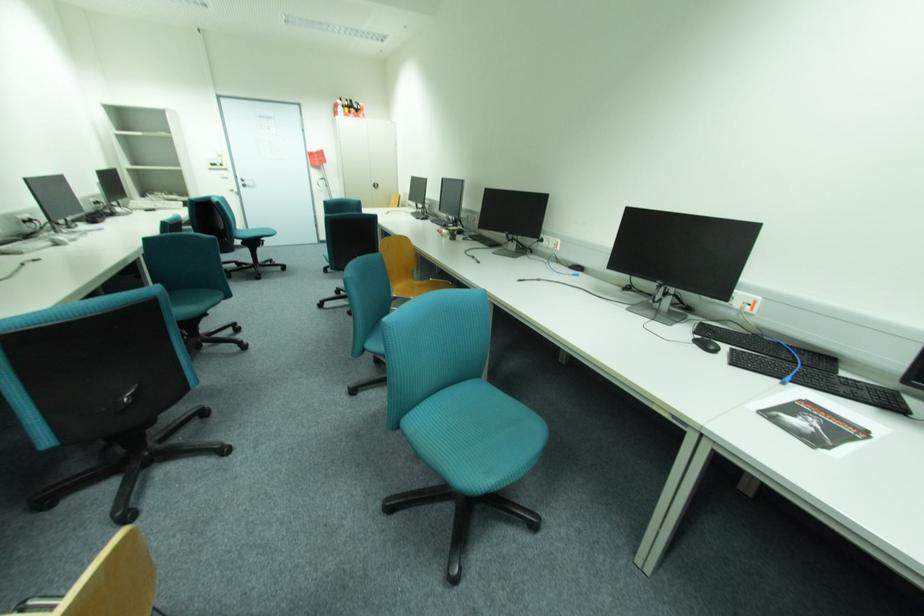
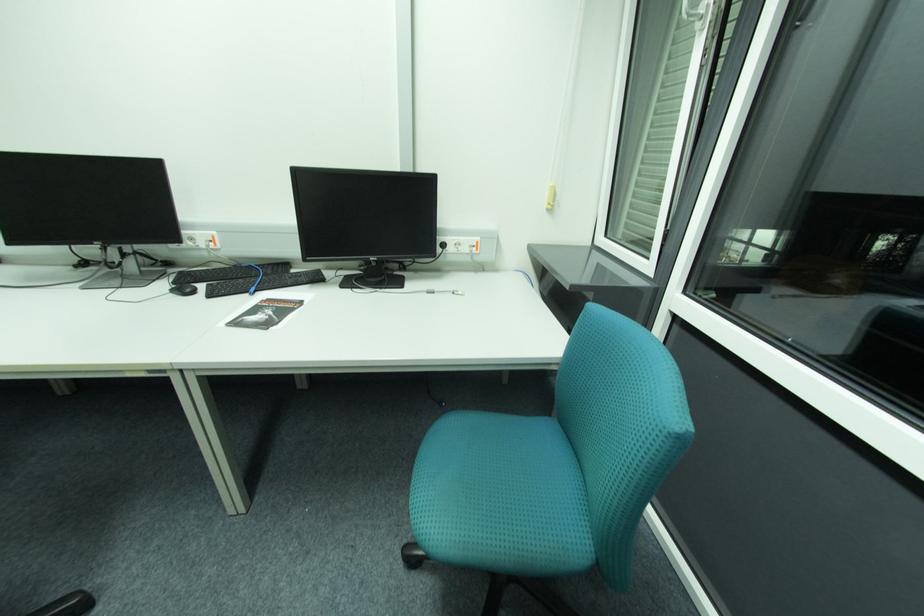
Where in the second image is the point corresponding to (716,347) from the first image?

(195, 291)